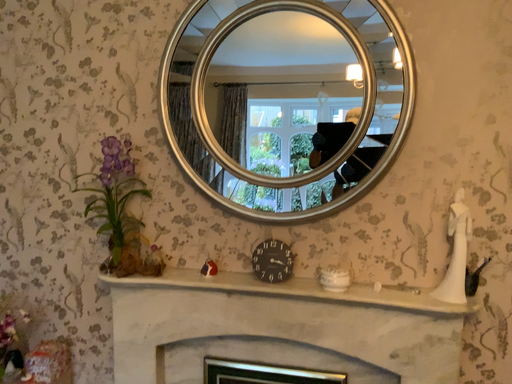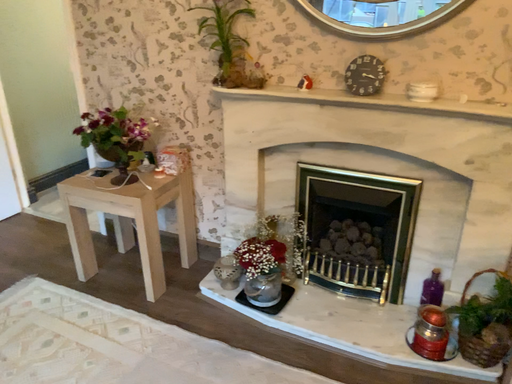
Question: Which way did the camera rotate in the video?

Choices:
 (A) rotated upward
 (B) rotated downward

Answer: (B)